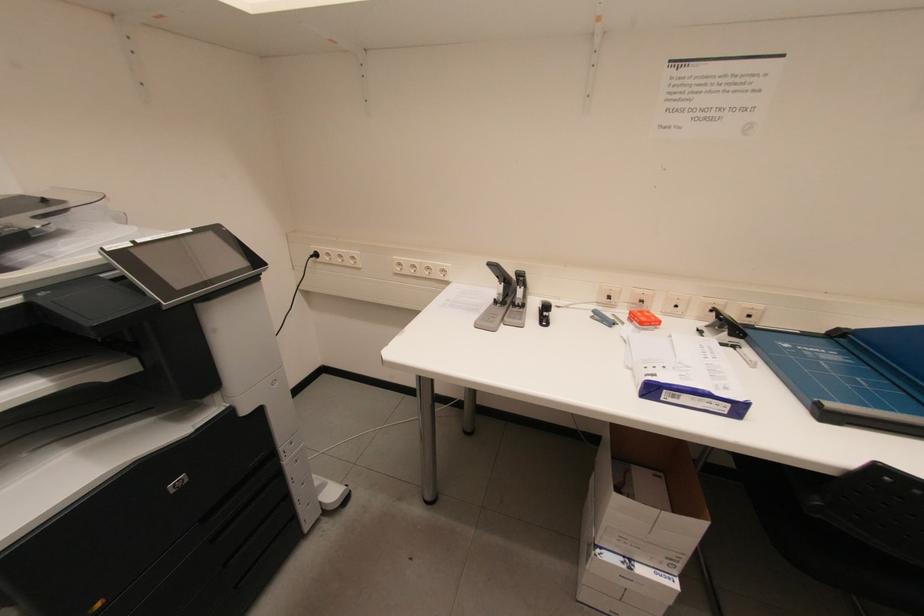
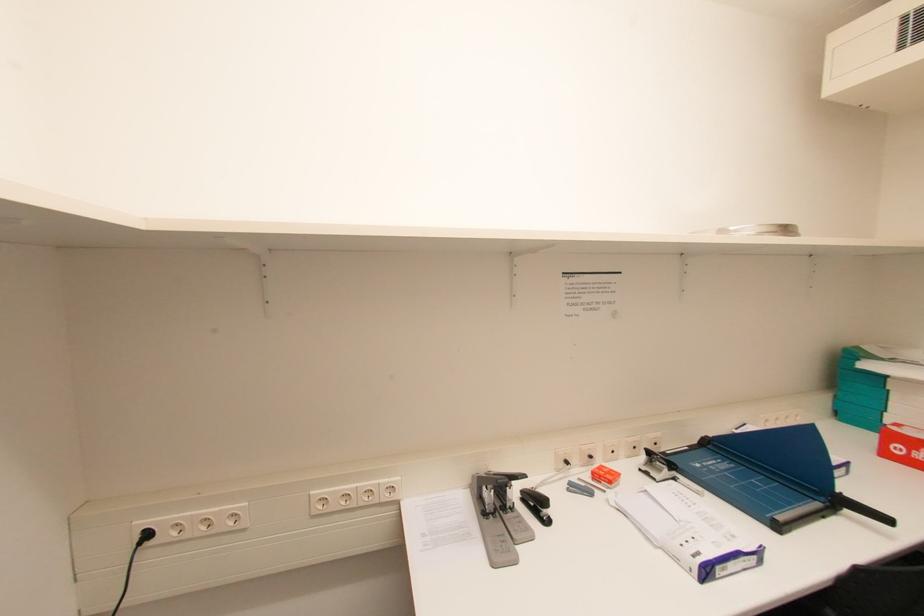
The first image is from the beginning of the video and the second image is from the end. How did the camera likely rotate when shooting the video?

The rotation direction of the camera is right-up.